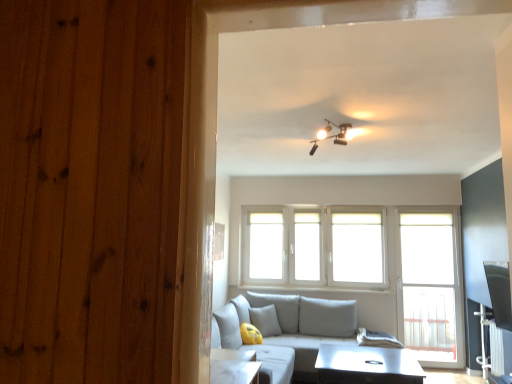
In order to face clear plastic screen door at right, should I rotate leftwards or rightwards?

You should look right and rotate roughly 22.098 degrees.

In order to face light gray fabric couch at center, should I rotate leftwards or rightwards?

You should look right and rotate roughly 6.859 degrees.

What do you see at coordinates (315, 247) in the screenshot?
I see `white glossy bay window at center` at bounding box center [315, 247].

You are a GUI agent. You are given a task and a screenshot of the screen. Output one action in this format:
    pyautogui.click(x=<x>, y=<y>)
    Task: Click on the clear plastic screen door at right
    
    Given the screenshot: What is the action you would take?
    pyautogui.click(x=431, y=288)

How different are the orientations of clear plastic screen door at right and yellow fabric pillow at lower center in degrees?

The facing directions of clear plastic screen door at right and yellow fabric pillow at lower center are 44.3 degrees apart.

In the scene shown: Is clear plastic screen door at right aimed at yellow fabric pillow at lower center?

No, clear plastic screen door at right is not oriented towards yellow fabric pillow at lower center.

Is clear plastic screen door at right beside yellow fabric pillow at lower center?

clear plastic screen door at right and yellow fabric pillow at lower center are not in contact.

Which object is further away from the camera, clear plastic screen door at right or yellow fabric pillow at lower center?

clear plastic screen door at right is further away from the camera.

I want to click on light fixture lying in front of the clear plastic screen door at right, so click(x=333, y=135).

Which point is more forward, [440,339] or [309,154]?

The point [309,154] is more forward.

Which of these two, clear plastic screen door at right or matte black track lights at upper center, is bigger?

clear plastic screen door at right.

Consider the image. Could you tell me if clear plastic screen door at right is facing matte black track lights at upper center?

No, clear plastic screen door at right is not facing towards matte black track lights at upper center.

At what (x,y) coordinates should I click in order to perform the action: click on bay window above the white fabric curtain at lower right (from a real-world perspective). Please return your answer as a coordinate pair (x, y). This screenshot has width=512, height=384. Looking at the image, I should click on (315, 247).

Do you think white fabric curtain at lower right is within white glossy bay window at center, or outside of it?

white fabric curtain at lower right is located beyond the bounds of white glossy bay window at center.

Is white fabric curtain at lower right thinner than white glossy bay window at center?

In fact, white fabric curtain at lower right might be wider than white glossy bay window at center.

Considering the positions of objects white fabric curtain at lower right and white glossy bay window at center in the image provided, who is more to the right, white fabric curtain at lower right or white glossy bay window at center?

white fabric curtain at lower right.

In the scene shown: Can we say yellow fabric pillow at lower center lies outside clear plastic screen door at right?

Yes, yellow fabric pillow at lower center is located beyond the bounds of clear plastic screen door at right.

From the image's perspective, is yellow fabric pillow at lower center under clear plastic screen door at right?

Indeed, from the image's perspective, yellow fabric pillow at lower center is shown beneath clear plastic screen door at right.

Based on the photo, considering their positions, is yellow fabric pillow at lower center located in front of or behind clear plastic screen door at right?

yellow fabric pillow at lower center is positioned closer to the viewer than clear plastic screen door at right.

Can you confirm if yellow fabric pillow at lower center is wider than clear plastic screen door at right?

Correct, the width of yellow fabric pillow at lower center exceeds that of clear plastic screen door at right.

Would you say clear plastic screen door at right is inside or outside light gray fabric couch at center?

The correct answer is: outside.

Is the position of clear plastic screen door at right less distant than that of light gray fabric couch at center?

No, clear plastic screen door at right is behind light gray fabric couch at center.

Considering the points (453, 341) and (297, 302), which point is in front, point (453, 341) or point (297, 302)?

The point (453, 341) is in front.

Between clear plastic screen door at right and light gray fabric couch at center, which one has less height?

With less height is light gray fabric couch at center.

Is light gray fabric couch at center bigger or smaller than white fabric curtain at lower right?

In the image, light gray fabric couch at center appears to be larger than white fabric curtain at lower right.

Is light gray fabric couch at center positioned with its back to white fabric curtain at lower right?

No, white fabric curtain at lower right is not at the back of light gray fabric couch at center.

Which object is wider, light gray fabric couch at center or white fabric curtain at lower right?

light gray fabric couch at center is wider.

Does yellow fabric pillow at lower center have a lesser height compared to white glossy table at center?

No.

From the image's perspective, which object appears higher, yellow fabric pillow at lower center or white glossy table at center?

yellow fabric pillow at lower center is shown above in the image.

At what (x,y) coordinates should I click in order to perform the action: click on table below the yellow fabric pillow at lower center (from the image's perspective). Please return your answer as a coordinate pair (x, y). Looking at the image, I should click on (366, 365).

Locate an element on the screen. The height and width of the screenshot is (384, 512). pillow located on the left of clear plastic screen door at right is located at coordinates (265, 320).

This screenshot has height=384, width=512. Identify the location of screen door below the matte black track lights at upper center (from the image's perspective). (431, 288).

When comparing their distances from white glossy bay window at center, does matte black track lights at upper center or clear plastic screen door at right seem further?

matte black track lights at upper center lies further to white glossy bay window at center than the other object.

Estimate the real-world distances between objects in this image. Which object is closer to white glossy bay window at center, white fabric curtain at lower right or light gray fabric couch at center?

The object closer to white glossy bay window at center is light gray fabric couch at center.

Based on their spatial positions, is white glossy bay window at center or white glossy table at center further from yellow fabric pillow at lower center?

white glossy table at center lies further to yellow fabric pillow at lower center than the other object.

Based on their spatial positions, is white glossy bay window at center or white fabric curtain at lower right further from light gray fabric couch at center?

white fabric curtain at lower right is positioned further to the anchor light gray fabric couch at center.

When comparing their distances from light gray fabric couch at center, does white fabric curtain at lower right or yellow fabric pillow at lower center seem closer?

yellow fabric pillow at lower center lies closer to light gray fabric couch at center than the other object.

Looking at the image, which one is located closer to clear plastic screen door at right, light gray fabric couch at center or white fabric curtain at lower right?

The object closer to clear plastic screen door at right is light gray fabric couch at center.

When comparing their distances from white fabric curtain at lower right, does yellow fabric pillow at lower center or matte black track lights at upper center seem further?

yellow fabric pillow at lower center.

From the image, which object appears to be nearer to white glossy table at center, white fabric curtain at lower right or light gray fabric couch at center?

white fabric curtain at lower right lies closer to white glossy table at center than the other object.

You are a GUI agent. You are given a task and a screenshot of the screen. Output one action in this format:
    pyautogui.click(x=<x>, y=<y>)
    Task: Click on the studio couch located between white glossy table at center and yellow fabric pillow at lower center in the depth direction
    This screenshot has width=512, height=384.
    Given the screenshot: What is the action you would take?
    pyautogui.click(x=287, y=325)

At what (x,y) coordinates should I click in order to perform the action: click on pillow between matte black track lights at upper center and light gray fabric couch at center vertically. Please return your answer as a coordinate pair (x, y). This screenshot has width=512, height=384. Looking at the image, I should click on (265, 320).

Find the location of a particular element. The height and width of the screenshot is (384, 512). pillow between white glossy table at center and white glossy bay window at center along the z-axis is located at coordinates (265, 320).

Where is `table between yellow fabric pillow at lower center and white fabric curtain at lower right`? table between yellow fabric pillow at lower center and white fabric curtain at lower right is located at coordinates (366, 365).